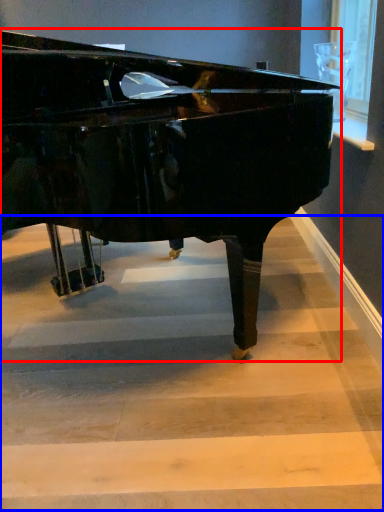
Question: Which object appears farthest to the camera in this image, piano (highlighted by a red box) or stairwell (highlighted by a blue box)?

Choices:
 (A) piano
 (B) stairwell

Answer: (B)